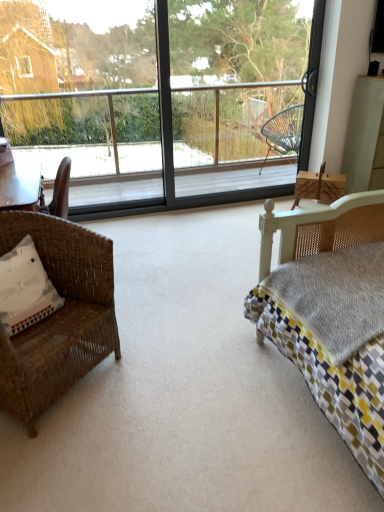
The image size is (384, 512). What are the coordinates of `space that is in front of woven brown chair at left` in the screenshot? It's located at (70, 458).